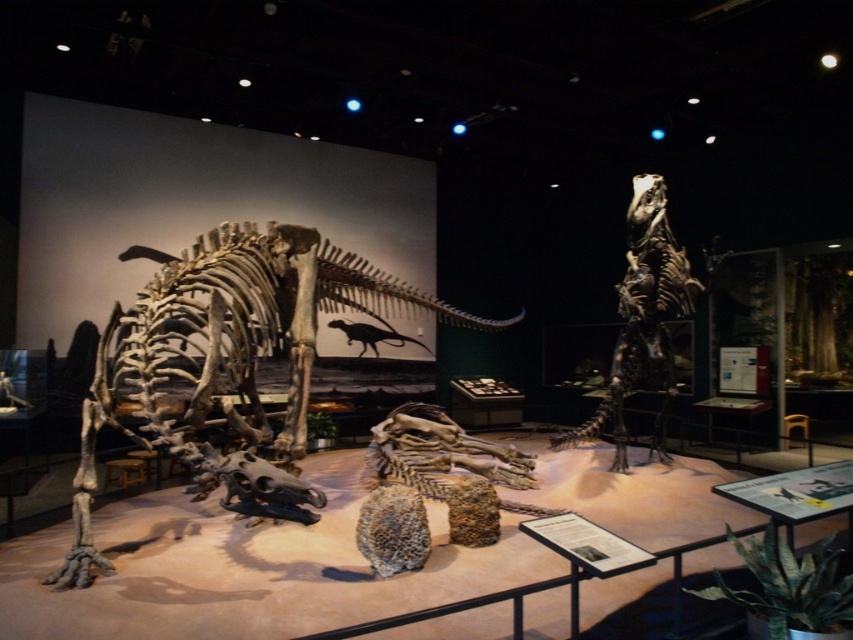
Question: Can you confirm if bone-like skeleton at left is thinner than shiny metallic dinosaur at center?

Choices:
 (A) yes
 (B) no

Answer: (A)

Question: Which of the following is the farthest from the observer?

Choices:
 (A) shiny metallic dinosaur at center
 (B) bone-like skeleton at left

Answer: (A)

Question: Does bone-like skeleton at left have a larger size compared to shiny metallic dinosaur at center?

Choices:
 (A) yes
 (B) no

Answer: (B)

Question: Does bone-like skeleton at left have a lesser width compared to shiny metallic dinosaur at center?

Choices:
 (A) yes
 (B) no

Answer: (A)